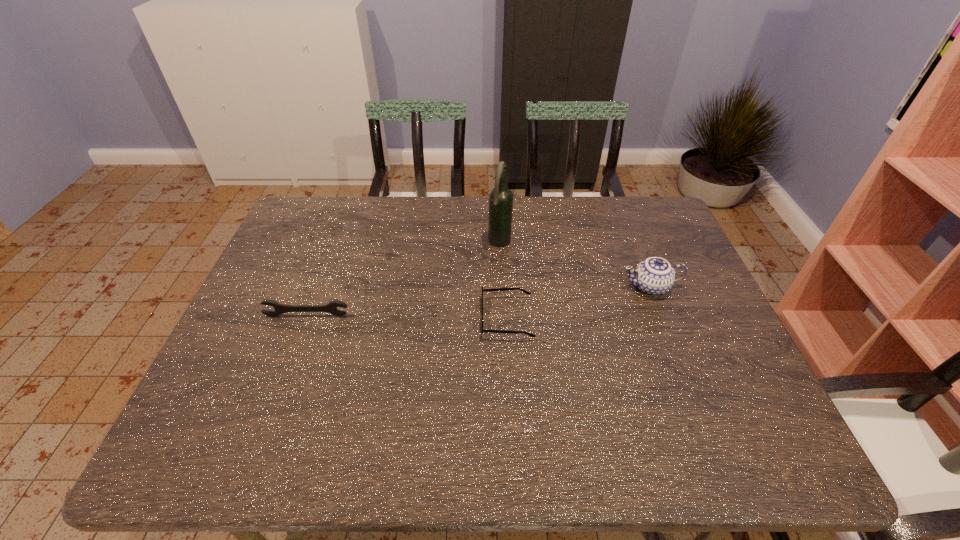
Identify the location of vacant area at the left edge. (223, 414).

Find the location of `vacant space at the right edge`. vacant space at the right edge is located at coordinates (684, 383).

Where is `blank space at the far right corner`? blank space at the far right corner is located at coordinates (623, 217).

The height and width of the screenshot is (540, 960). I want to click on free space between the wrench and the sunglasses, so click(407, 316).

Where is `free point between the rightmost object and the shortest object`? This screenshot has height=540, width=960. free point between the rightmost object and the shortest object is located at coordinates (579, 302).

You are a GUI agent. You are given a task and a screenshot of the screen. Output one action in this format:
    pyautogui.click(x=<x>, y=<y>)
    Task: Click on the empty space between the wrench and the beer bottle
    
    Given the screenshot: What is the action you would take?
    pyautogui.click(x=403, y=279)

Identify the location of free space between the sunglasses and the third tallest object. (407, 316).

Image resolution: width=960 pixels, height=540 pixels. I want to click on free space between the tallest object and the chinaware, so click(575, 265).

Where is `vacant space that is in between the wrench and the farthest object`? The image size is (960, 540). vacant space that is in between the wrench and the farthest object is located at coordinates (403, 279).

Find the location of a particular element. The height and width of the screenshot is (540, 960). free area in between the second tallest object and the shortest object is located at coordinates pyautogui.click(x=579, y=302).